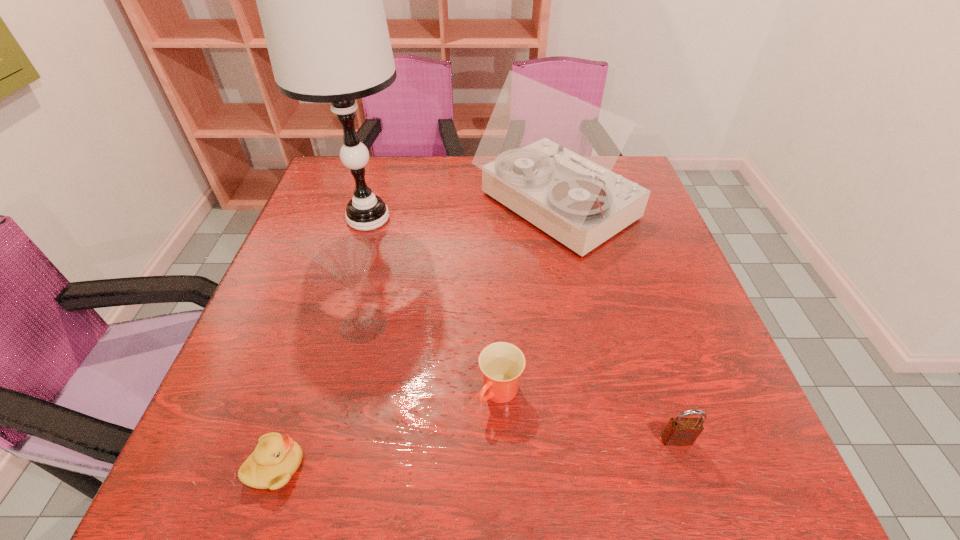
The height and width of the screenshot is (540, 960). I want to click on vacant area at the far right corner, so click(x=619, y=171).

Locate an element on the screen. The image size is (960, 540). vacant area between the fourth nearest object and the cup is located at coordinates (432, 359).

This screenshot has height=540, width=960. I want to click on empty location between the third nearest object and the duckling, so click(x=388, y=429).

Find the location of a particular element. empty location between the cup and the duckling is located at coordinates (388, 429).

Find the location of a particular element. This screenshot has width=960, height=540. free spot between the duckling and the fourth farthest object is located at coordinates [388, 429].

Image resolution: width=960 pixels, height=540 pixels. Identify the location of free space between the record player and the tallest object. [462, 213].

Identify the location of empty location between the tallest object and the padlock. (522, 329).

You are a GUI agent. You are given a task and a screenshot of the screen. Output one action in this format:
    pyautogui.click(x=<x>, y=<y>)
    Task: Click on the free space between the cup and the padlock
    
    Given the screenshot: What is the action you would take?
    pyautogui.click(x=588, y=416)

Locate an element on the screen. The height and width of the screenshot is (540, 960). empty location between the padlock and the fifth shortest object is located at coordinates pos(615,324).

This screenshot has width=960, height=540. In order to click on free space between the third tallest object and the padlock in this screenshot , I will do 520,382.